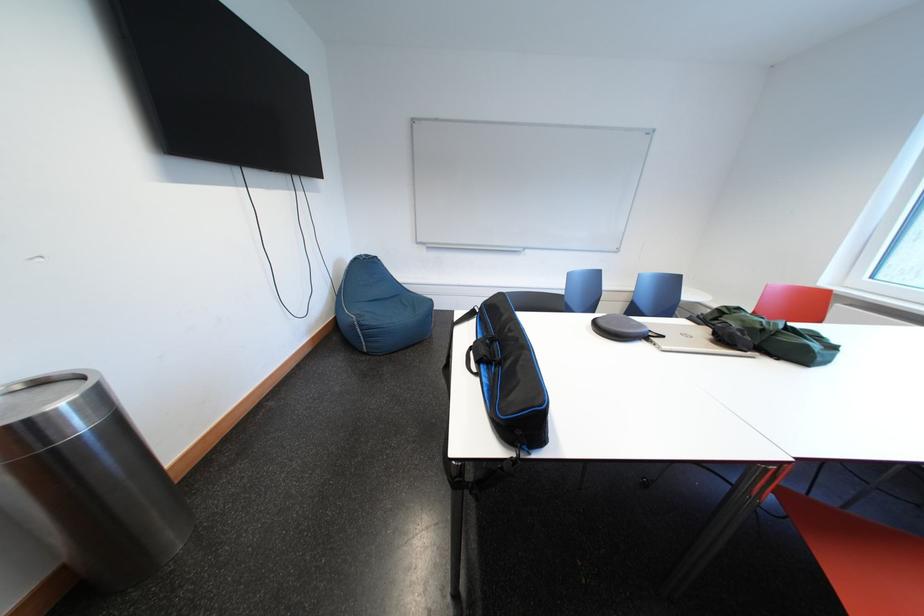
The height and width of the screenshot is (616, 924). Find the location of `laptop lid`. laptop lid is located at coordinates (688, 339).